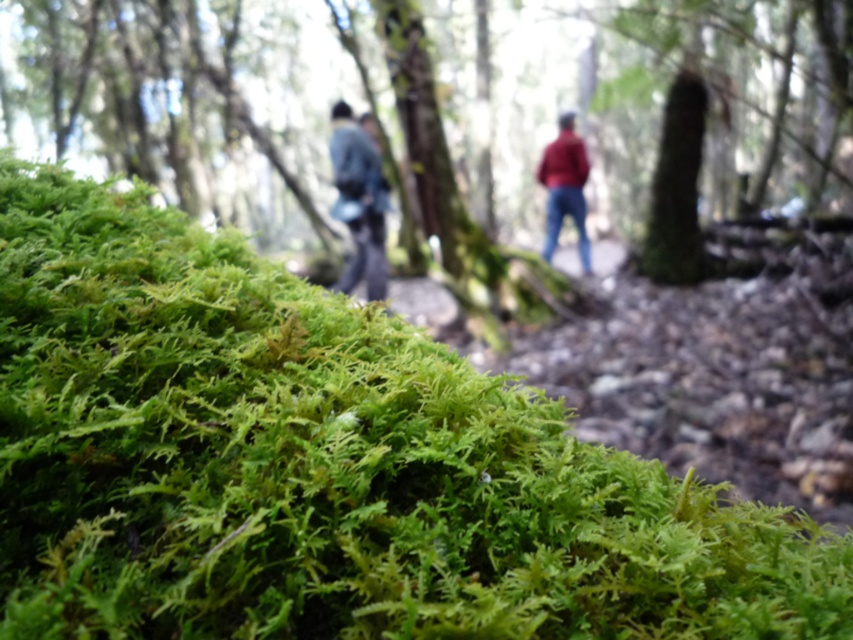
Question: Among these objects, which one is farthest from the camera?

Choices:
 (A) dark blue jacket at center
 (B) denim jacket at center

Answer: (A)

Question: Is green mossy rock at lower left bigger than matte red jacket at center?

Choices:
 (A) yes
 (B) no

Answer: (A)

Question: From the image, what is the correct spatial relationship of dark blue jacket at center in relation to matte red jacket at center?

Choices:
 (A) left
 (B) right

Answer: (A)

Question: Which object is closer to the camera taking this photo?

Choices:
 (A) denim jacket at center
 (B) green mossy rock at lower left
 (C) dark blue jacket at center
 (D) matte red jacket at center

Answer: (B)

Question: Among these objects, which one is nearest to the camera?

Choices:
 (A) matte red jacket at center
 (B) dark blue jacket at center
 (C) green mossy rock at lower left
 (D) denim jacket at center

Answer: (C)

Question: Is green mossy rock at lower left positioned before denim jacket at center?

Choices:
 (A) yes
 (B) no

Answer: (A)